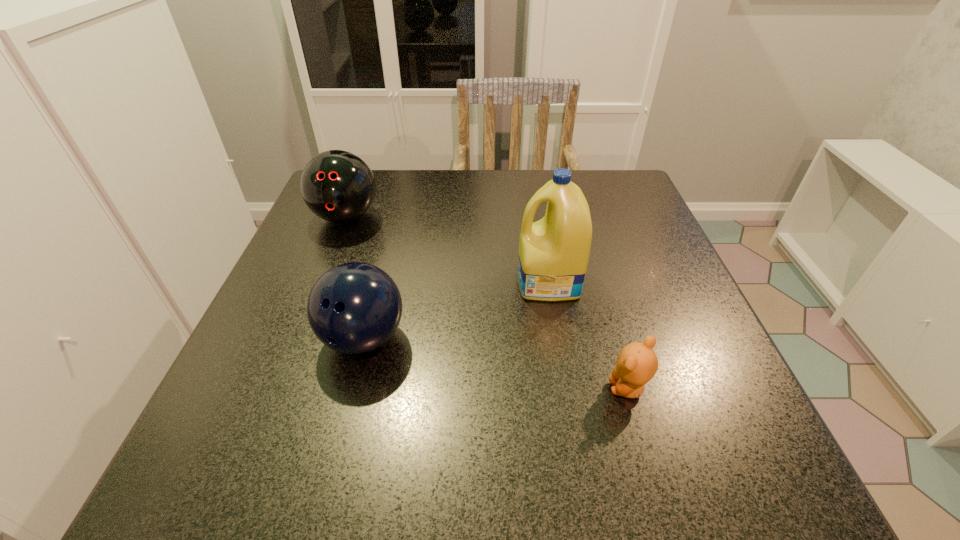
Identify the location of detergent. (553, 252).

I want to click on the tallest object, so click(553, 252).

The width and height of the screenshot is (960, 540). Find the location of `the farther bowling ball`. the farther bowling ball is located at coordinates (338, 186).

Locate an element on the screen. the nearer bowling ball is located at coordinates [353, 308].

The image size is (960, 540). I want to click on the shortest object, so click(636, 365).

I want to click on teddy bear, so click(636, 365).

Locate an element on the screen. The height and width of the screenshot is (540, 960). free location located 0.080m on the label of the second object from right to left is located at coordinates (477, 282).

Where is `free space located 0.290m on the label of the second object from right to left`? free space located 0.290m on the label of the second object from right to left is located at coordinates (372, 282).

Where is `blank space located 0.200m on the label of the second object from right to left`? This screenshot has width=960, height=540. blank space located 0.200m on the label of the second object from right to left is located at coordinates (417, 282).

Identify the location of blank space located 0.130m on the surface of the farthest object near the finger holes. Image resolution: width=960 pixels, height=540 pixels. (323, 276).